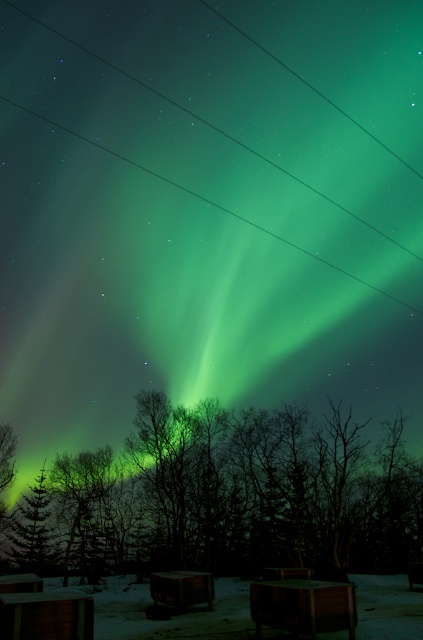
Question: Considering the relative positions of green matte tree at lower left and transparent glass power lines at upper center in the image provided, where is green matte tree at lower left located with respect to transparent glass power lines at upper center?

Choices:
 (A) left
 (B) right

Answer: (A)

Question: Does green leafy tree at center come behind green matte tree at lower left?

Choices:
 (A) yes
 (B) no

Answer: (B)

Question: Is green leafy tree at center further to the viewer compared to transparent glass power lines at upper center?

Choices:
 (A) no
 (B) yes

Answer: (A)

Question: Considering the real-world distances, which object is closest to the green matte tree at lower left?

Choices:
 (A) transparent glass power lines at upper center
 (B) green leafy tree at center

Answer: (B)

Question: Among these objects, which one is nearest to the camera?

Choices:
 (A) green leafy tree at center
 (B) transparent glass power lines at upper center
 (C) green matte tree at lower left

Answer: (A)

Question: Which point is closer to the camera?

Choices:
 (A) (33, 540)
 (B) (307, 253)

Answer: (A)